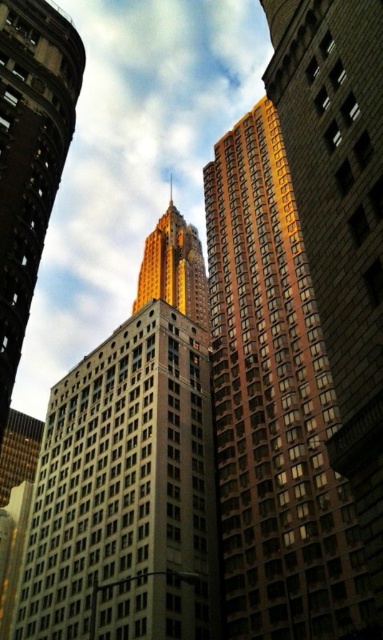
You are an architect analyzing the urban skyline. You observe the matte glass skyscraper at center and the gold reflective skyscraper at center. Which of these two buildings has a narrower width at their base?

The matte glass skyscraper at center is thinner than the gold reflective skyscraper at center, so it has a narrower width at their base.

You are a drone operator tasked with flying a drone between two buildings in the city. You need to ensure the drone can safely pass between the white concrete building at center and the gold reflective skyscraper at center. What is the minimum distance the drone must maintain between the two buildings to avoid collision?

The white concrete building at center is 77.63 meters away from the gold reflective skyscraper at center. Therefore, the drone must maintain a minimum distance of at least 77.63 meters between the two buildings to avoid collision.